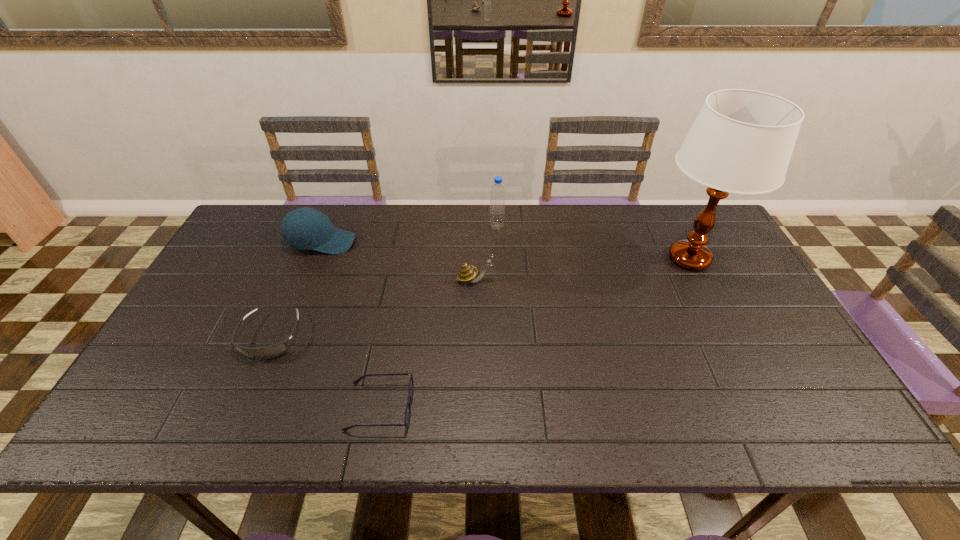
The width and height of the screenshot is (960, 540). What are the coordinates of `vacant area between the tallest object and the baseball cap` in the screenshot? It's located at (506, 251).

What are the coordinates of `free space between the second nearest object and the tallest object` in the screenshot? It's located at (480, 298).

Find the location of `vacant area between the water bottle and the fifth farthest object`. vacant area between the water bottle and the fifth farthest object is located at coordinates (383, 282).

Locate an element on the screen. The height and width of the screenshot is (540, 960). unoccupied area between the snail and the water bottle is located at coordinates (486, 253).

Locate which object ranks in proximity to the snail. Please provide its 2D coordinates. Your answer should be formatted as a tuple, i.e. [(x, y)], where the tuple contains the x and y coordinates of a point satisfying the conditions above.

[(497, 194)]

Where is `object that is the second closest to the goggles`? object that is the second closest to the goggles is located at coordinates pyautogui.click(x=305, y=228).

Find the location of a particular element. free space that satisfies the following two spatial constraints: 1. on the front side of the water bottle; 2. on the front-facing side of the baseball cap is located at coordinates (497, 242).

Where is `free region that satisfies the following two spatial constraints: 1. on the face of the snail; 2. on the lenses of the goggles`? This screenshot has height=540, width=960. free region that satisfies the following two spatial constraints: 1. on the face of the snail; 2. on the lenses of the goggles is located at coordinates (474, 337).

Identify the location of vacant position in the image that satisfies the following two spatial constraints: 1. on the front-facing side of the baseball cap; 2. on the lenses of the goggles. The image size is (960, 540). pyautogui.click(x=284, y=337).